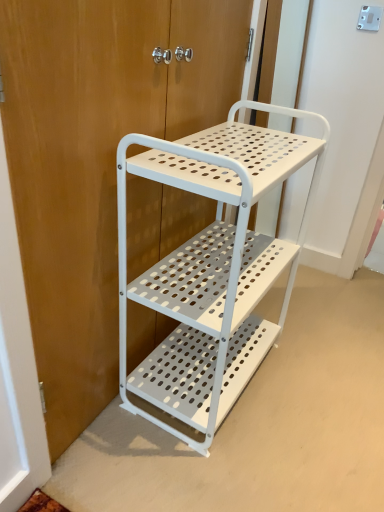
Identify the location of free space in front of white perforated metal cart at center. (203, 468).